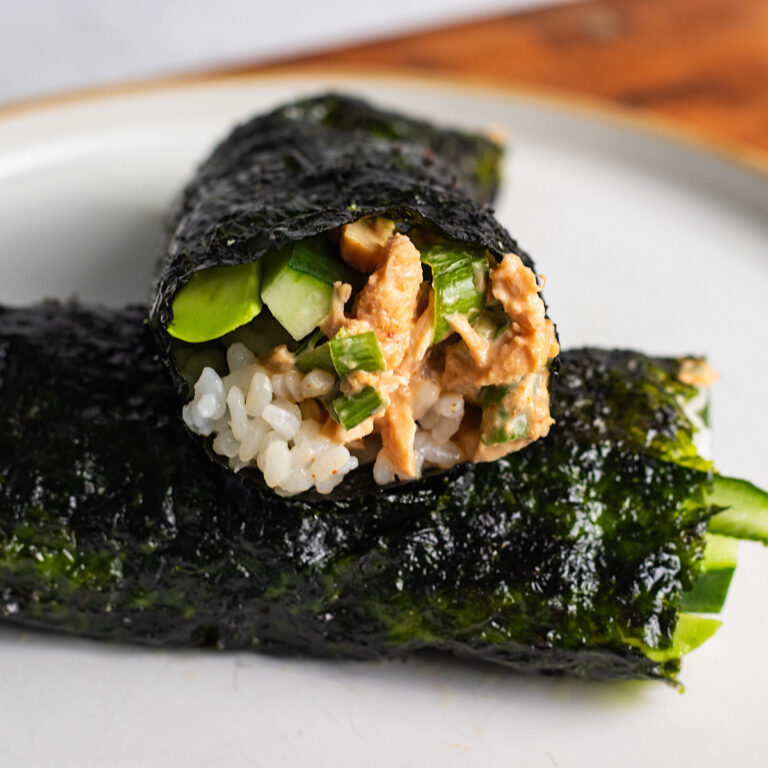
The image size is (768, 768). I want to click on plate, so click(x=343, y=707), click(x=670, y=210), click(x=164, y=141).